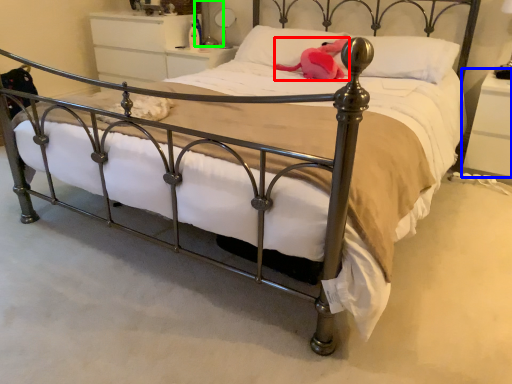
Question: Which object is positioned farthest from animal (highlighted by a red box)? Select from nightstand (highlighted by a blue box) and table lamp (highlighted by a green box).

Choices:
 (A) nightstand
 (B) table lamp

Answer: (B)